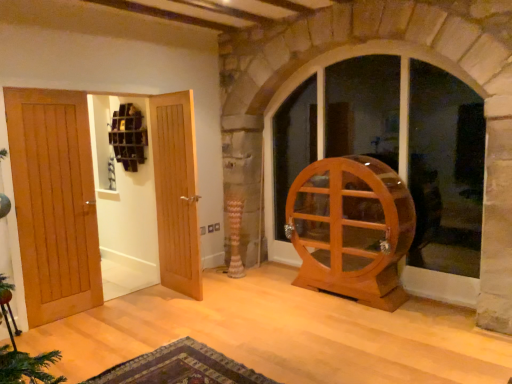
Locate an element on the screen. free space in front of light brown wood door at left, positioned as the 2th door in left-to-right order is located at coordinates (87, 322).